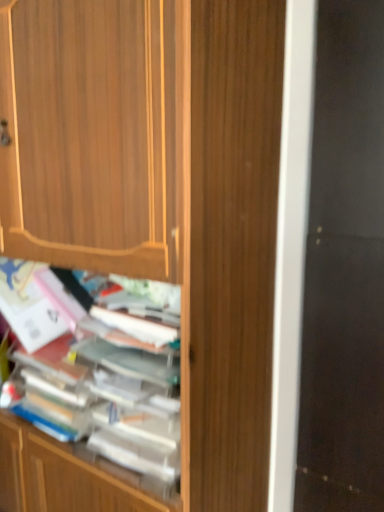
Question: Does point (152, 196) appear closer or farther from the camera than point (125, 402)?

Choices:
 (A) closer
 (B) farther

Answer: (A)

Question: Is wooden cabinet at center situated inside wooden books at center or outside?

Choices:
 (A) outside
 (B) inside

Answer: (A)

Question: Which is nearer to the black glass screen door at right?

Choices:
 (A) wooden cabinet at center
 (B) wooden books at center

Answer: (A)

Question: Estimate the real-world distances between objects in this image. Which object is closer to the black glass screen door at right?

Choices:
 (A) wooden cabinet at center
 (B) wooden books at center

Answer: (A)